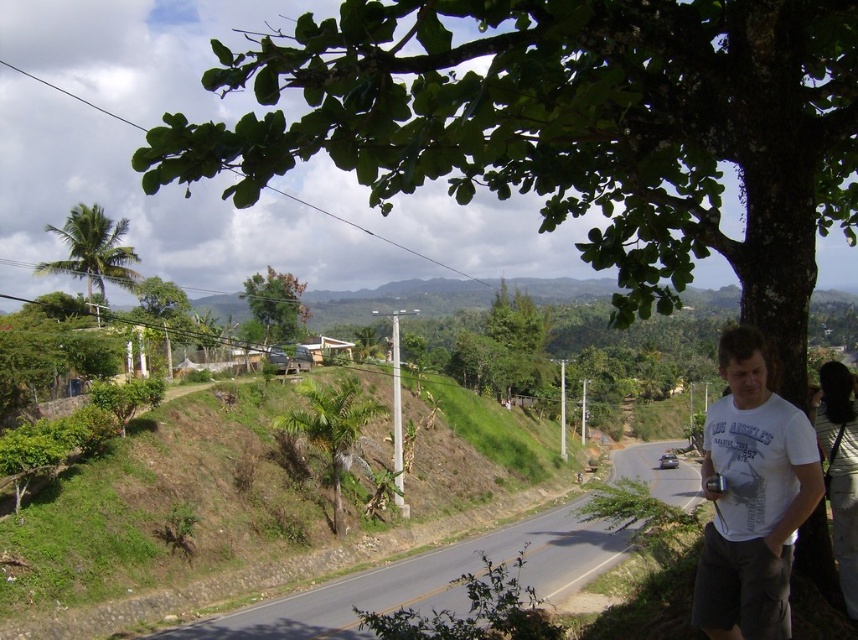
Is white cotton shirt at right wider than green leafy tree at upper center?

In fact, white cotton shirt at right might be narrower than green leafy tree at upper center.

Between point (855, 598) and point (249, 330), which one is positioned behind?

The point (249, 330) is more distant.

In order to click on white cotton shirt at right in this screenshot , I will do `click(840, 468)`.

Is green grassy hillside at lower left shorter than white cotton shirt at right?

In fact, green grassy hillside at lower left may be taller than white cotton shirt at right.

Does green grassy hillside at lower left have a greater height compared to white cotton shirt at right?

Yes.

Who is more forward, (500, 486) or (837, 445)?

Positioned in front is point (837, 445).

At what (x,y) coordinates should I click in order to perform the action: click on green grassy hillside at lower left. Please return your answer as a coordinate pair (x, y). This screenshot has width=858, height=640. Looking at the image, I should click on (255, 508).

Who is shorter, green grassy hillside at lower left or white cotton t-shirt at right?

Standing shorter between the two is white cotton t-shirt at right.

Which is in front, point (500, 492) or point (751, 611)?

Point (751, 611) is more forward.

Find the location of `green grassy hillside at lower left`. green grassy hillside at lower left is located at coordinates (255, 508).

Locate an element on the screen. green grassy hillside at lower left is located at coordinates (255, 508).